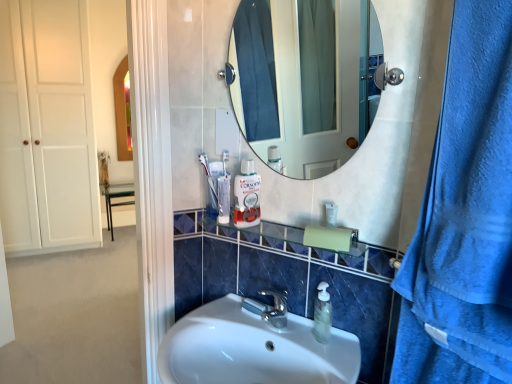
Image resolution: width=512 pixels, height=384 pixels. What do you see at coordinates (301, 80) in the screenshot?
I see `white marble mirror at upper center` at bounding box center [301, 80].

Describe the element at coordinates (253, 349) in the screenshot. The image size is (512, 384). I see `white glossy sink at center` at that location.

The image size is (512, 384). Describe the element at coordinates (428, 357) in the screenshot. I see `blue textured towel at right` at that location.

What do you see at coordinates (247, 196) in the screenshot?
I see `white glossy mouthwash at center` at bounding box center [247, 196].

This screenshot has width=512, height=384. What are the coordinates of `clear glass shelf at center` in the screenshot? It's located at (303, 247).

Is white glossy sink at center inside or outside of white matte closet door at left?

white glossy sink at center is outside white matte closet door at left.

Does white glossy sink at center come in front of white matte closet door at left?

Yes.

Which point is more forward, (339, 337) or (123, 167)?

Point (339, 337)

From a real-world perspective, is white glossy sink at center physically below white matte closet door at left?

Yes, from a real-world perspective, white glossy sink at center is below white matte closet door at left.

Between white marble mirror at upper center and blue terry cloth towel at right, which one has larger size?

blue terry cloth towel at right.

Is white marble mirror at upper center spatially inside blue terry cloth towel at right, or outside of it?

white marble mirror at upper center is not enclosed by blue terry cloth towel at right.

The width and height of the screenshot is (512, 384). What are the coordinates of `mirror above the blue terry cloth towel at right (from the image's perspective)` in the screenshot? It's located at (301, 80).

Consider the image. From a real-world perspective, is white marble mirror at upper center located higher than blue terry cloth towel at right?

Yes, from a real-world perspective, white marble mirror at upper center is on top of blue terry cloth towel at right.

Find the location of a particular element. The height and width of the screenshot is (384, 512). mirror behind the blue terry cloth towel at right is located at coordinates pos(301,80).

Is blue terry cloth towel at right with white marble mirror at upper center?

No, blue terry cloth towel at right is not making contact with white marble mirror at upper center.

Which is closer, (x=404, y=271) or (x=242, y=50)?

Clearly, point (x=404, y=271) is closer to the camera than point (x=242, y=50).

Is blue terry cloth towel at right smaller than white marble mirror at upper center?

Incorrect, blue terry cloth towel at right is not smaller in size than white marble mirror at upper center.

In the scene shown: Considering the relative sizes of blue textured towel at right and white glossy sink at center in the image provided, is blue textured towel at right taller than white glossy sink at center?

Incorrect, the height of blue textured towel at right is not larger of that of white glossy sink at center.

Is blue textured towel at right positioned with its back to white glossy sink at center?

No, blue textured towel at right is not facing away from white glossy sink at center.

Does point (434, 375) come in front of point (274, 352)?

Yes, point (434, 375) is closer to viewer.

From the picture: Which is correct: blue textured towel at right is inside white glossy sink at center, or outside of it?

blue textured towel at right is located beyond the bounds of white glossy sink at center.

From a real-world perspective, relative to white glossy mouthwash at center, is clear glass shelf at center vertically above or below?

clear glass shelf at center is below white glossy mouthwash at center.

How different are the orientations of clear glass shelf at center and white glossy mouthwash at center in degrees?

They differ by 59.6 degrees in their facing directions.

Considering the sizes of objects clear glass shelf at center and white glossy mouthwash at center in the image provided, who is shorter, clear glass shelf at center or white glossy mouthwash at center?

clear glass shelf at center is shorter.

Could you tell me if clear glass shelf at center is turned towards white glossy mouthwash at center?

No, clear glass shelf at center is not turned towards white glossy mouthwash at center.

Is white matte closet door at left touching blue terry cloth towel at right?

white matte closet door at left and blue terry cloth towel at right are clearly separated.

Considering the positions of point (92, 96) and point (467, 337), is point (92, 96) closer or farther from the camera than point (467, 337)?

Point (92, 96).

Considering the sizes of objects white matte closet door at left and blue terry cloth towel at right in the image provided, who is smaller, white matte closet door at left or blue terry cloth towel at right?

blue terry cloth towel at right is smaller.

Between white glossy sink at center and blue textured towel at right, which one is positioned behind?

white glossy sink at center is more distant.

Looking at this image, is white glossy sink at center situated inside blue textured towel at right or outside?

white glossy sink at center exists outside the volume of blue textured towel at right.

Consider the image. Measure the distance between white glossy sink at center and blue textured towel at right.

white glossy sink at center and blue textured towel at right are 14.84 inches apart from each other.

Identify the location of side lying behind the white glossy sink at center. (75, 315).

The image size is (512, 384). In order to click on shower curtain below the white marble mirror at upper center (from the image's perspective) in this screenshot , I will do `click(464, 217)`.

Estimate the real-world distances between objects in this image. Which object is closer to white glossy sink at center, white glossy mouthwash at center or blue terry cloth towel at right?

white glossy mouthwash at center is positioned closer to the anchor white glossy sink at center.

Looking at the image, which one is located closer to clear glass shelf at center, blue terry cloth towel at right or white marble mirror at upper center?

Among the two, blue terry cloth towel at right is located nearer to clear glass shelf at center.

From the picture: From the image, which object appears to be nearer to clear glass shelf at center, white matte closet door at left or blue terry cloth towel at right?

Based on the image, blue terry cloth towel at right appears to be nearer to clear glass shelf at center.

Looking at the image, which one is located closer to blue textured towel at right, white glossy sink at center or white glossy mouthwash at center?

white glossy sink at center lies closer to blue textured towel at right than the other object.

Which object lies further to the anchor point white matte closet door at left, white marble mirror at upper center or white glossy mouthwash at center?

white glossy mouthwash at center is further to white matte closet door at left.

When comparing their distances from white glossy sink at center, does blue textured towel at right or white marble mirror at upper center seem further?

white marble mirror at upper center is further to white glossy sink at center.

Based on their spatial positions, is white glossy mouthwash at center or clear glass shelf at center closer to blue textured towel at right?

The object closer to blue textured towel at right is clear glass shelf at center.

Based on their spatial positions, is white glossy mouthwash at center or white matte closet door at left closer to clear glass shelf at center?

white glossy mouthwash at center.

Locate an element on the screen. mouthwash situated between white matte closet door at left and blue terry cloth towel at right from left to right is located at coordinates (247, 196).

Image resolution: width=512 pixels, height=384 pixels. What are the coordinates of `bath towel between blue terry cloth towel at right and white glossy sink at center in the up-down direction` in the screenshot? It's located at (428, 357).

Find the location of a particular element. bath towel between clear glass shelf at center and white glossy sink at center in the up-down direction is located at coordinates (428, 357).

Find the location of `balustrade between white marble mirror at upper center and white glossy sink at center vertically`. balustrade between white marble mirror at upper center and white glossy sink at center vertically is located at coordinates (303, 247).